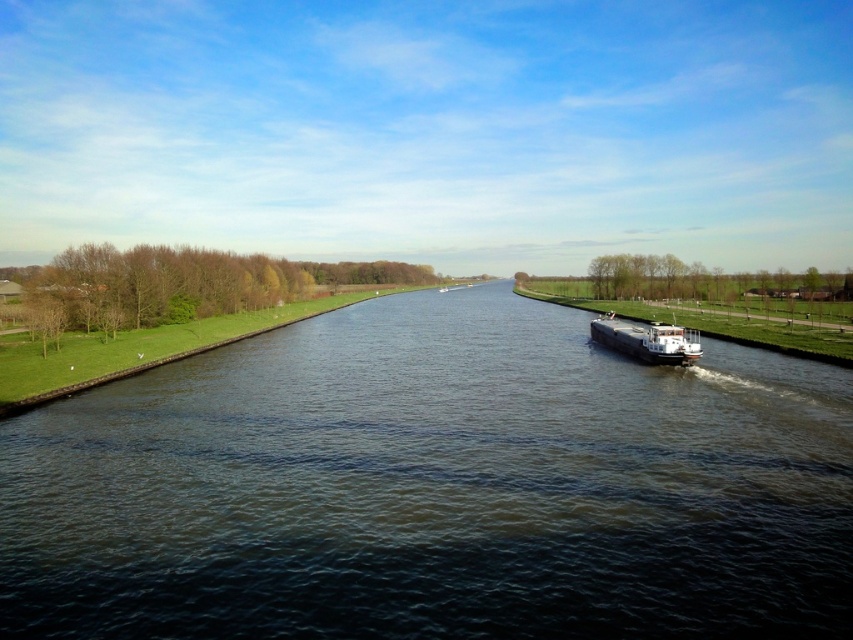
Does point (647, 442) come in front of point (607, 330)?

Yes, it is.

Can you confirm if dark blue water at center is thinner than white glossy barge at center?

A: No, dark blue water at center is not thinner than white glossy barge at center.

Who is more forward, (207, 452) or (654, 332)?

Point (207, 452) is more forward.

Identify the location of dark blue water at center. The width and height of the screenshot is (853, 640). (434, 486).